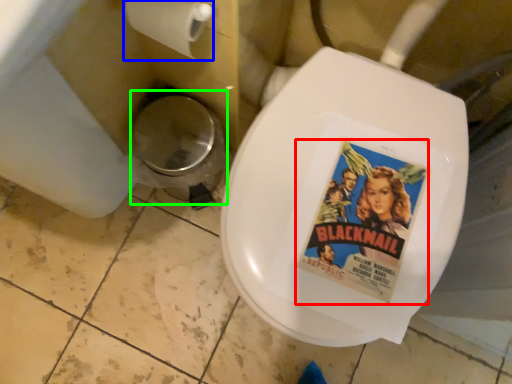
Question: Which object is positioned farthest from movie poster (highlighted by a red box)? Select from toilet paper (highlighted by a blue box) and potty (highlighted by a green box).

Choices:
 (A) toilet paper
 (B) potty

Answer: (B)